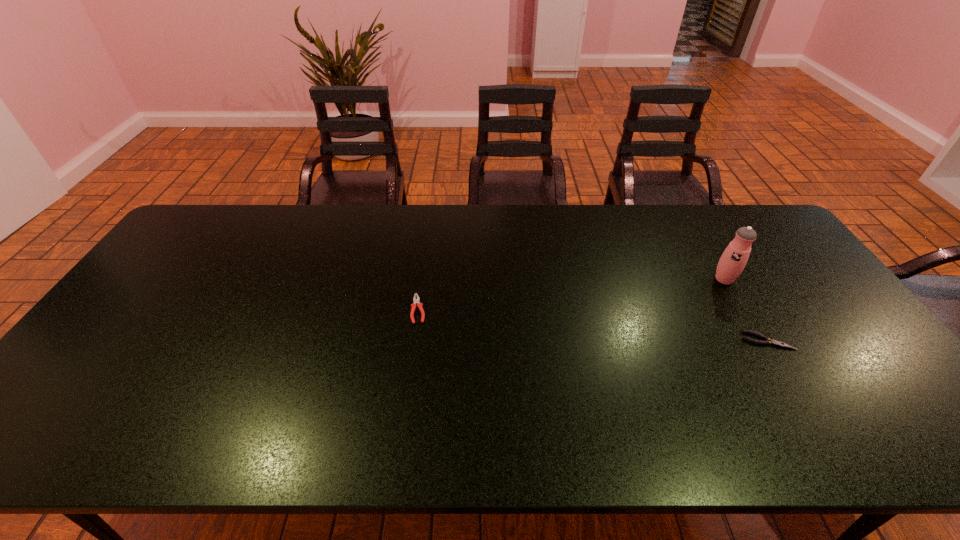
Image resolution: width=960 pixels, height=540 pixels. I want to click on the tallest object, so click(733, 260).

This screenshot has height=540, width=960. What are the coordinates of `thermos bottle` in the screenshot? It's located at (733, 260).

The image size is (960, 540). What are the coordinates of `the right pliers` in the screenshot? It's located at (768, 341).

Locate an element on the screen. This screenshot has height=540, width=960. the nearer pliers is located at coordinates (768, 341).

The width and height of the screenshot is (960, 540). What are the coordinates of `the leftmost object` in the screenshot? It's located at (415, 301).

The width and height of the screenshot is (960, 540). I want to click on the second farthest object, so click(x=415, y=301).

The height and width of the screenshot is (540, 960). In order to click on vacant space situated 0.280m on the back of the farthest object in this screenshot , I will do point(688,219).

Where is `vacant space located on the back of the nearest object`? This screenshot has width=960, height=540. vacant space located on the back of the nearest object is located at coordinates (715, 255).

At what (x,y) coordinates should I click in order to perform the action: click on vacant space located on the front of the farther pliers. Please return your answer as a coordinate pair (x, y). Looking at the image, I should click on (410, 370).

The height and width of the screenshot is (540, 960). In the image, there is a desktop. In order to click on vacant space at the far edge in this screenshot , I will do `click(412, 220)`.